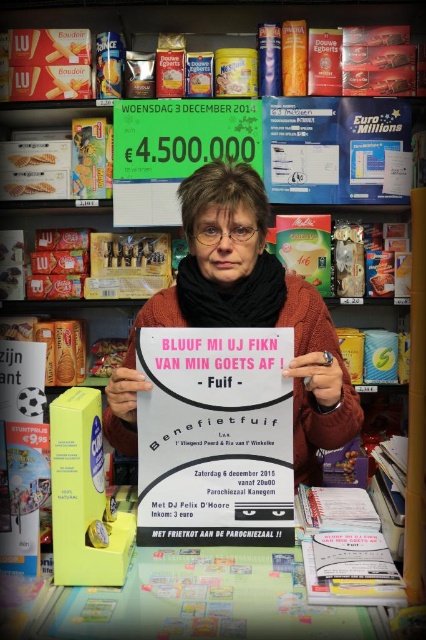
Question: Can you confirm if matte white poster at center is bigger than white paper book at lower center?

Choices:
 (A) yes
 (B) no

Answer: (A)

Question: Can you confirm if pink paper poster at center is bigger than matte white poster at center?

Choices:
 (A) no
 (B) yes

Answer: (A)

Question: Which of the following is the closest to the observer?

Choices:
 (A) (112, 401)
 (B) (183, 481)
 (C) (359, 595)

Answer: (C)

Question: Which object is closer to the camera taking this photo?

Choices:
 (A) matte white poster at center
 (B) white paper book at lower center
 (C) pink paper poster at center

Answer: (B)

Question: Is matte white poster at center to the left of white paper book at lower center from the viewer's perspective?

Choices:
 (A) no
 (B) yes

Answer: (B)

Question: Which of the following is the farthest from the observer?

Choices:
 (A) pink paper poster at center
 (B) matte white poster at center

Answer: (B)